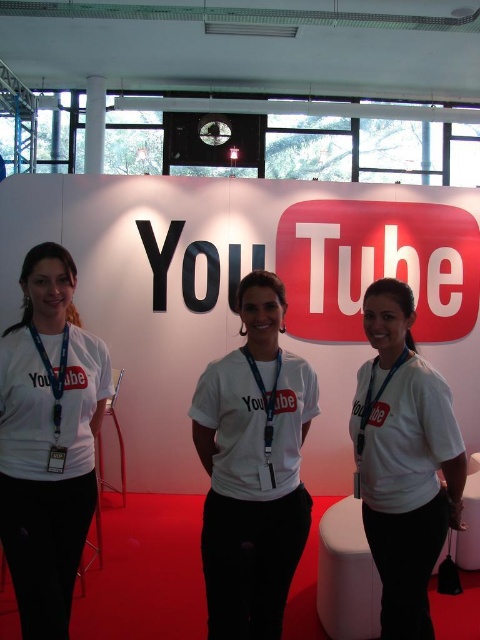
Looking at this image, you are standing in front of the YouTube promotional backdrop and see two points marked on the floor. The first point is at coordinate point (59, 508) and the second is at point (50, 454). Which point is closer to you?

Point (59, 508) is further to the viewer than point (50, 454), so the closer point to you is point (50, 454).